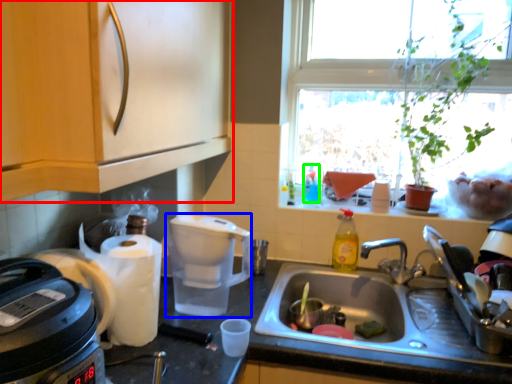
Question: Which object is positioned closest to cabinetry (highlighted by a red box)? Select from coffeepot (highlighted by a blue box) and bottle (highlighted by a green box).

Choices:
 (A) coffeepot
 (B) bottle

Answer: (A)